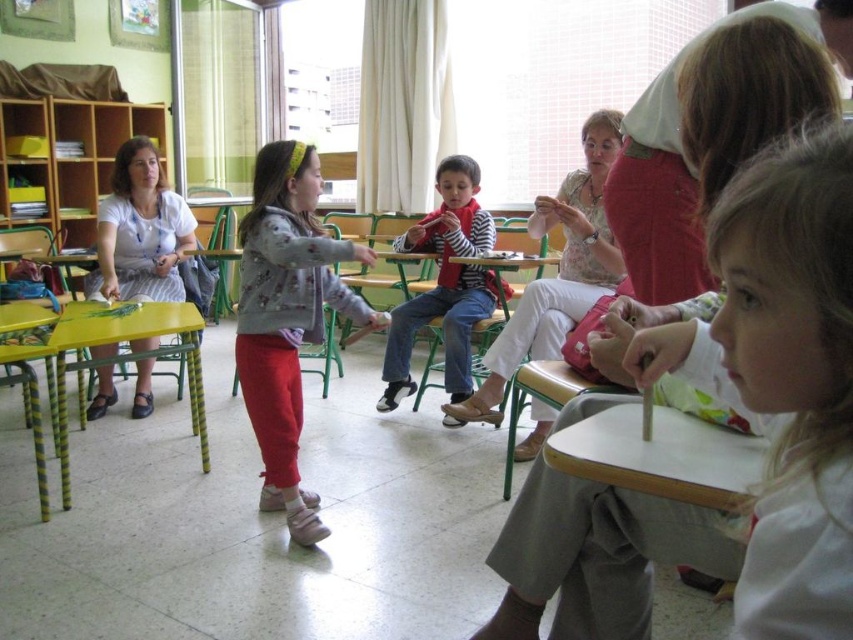
Does fluffy gray sweater at center have a smaller size compared to striped cotton shirt at center?

Indeed, fluffy gray sweater at center has a smaller size compared to striped cotton shirt at center.

Is point (350, 289) farther from camera compared to point (397, 317)?

Yes, it is behind point (397, 317).

Find the location of a particular element. The height and width of the screenshot is (640, 853). fluffy gray sweater at center is located at coordinates (287, 316).